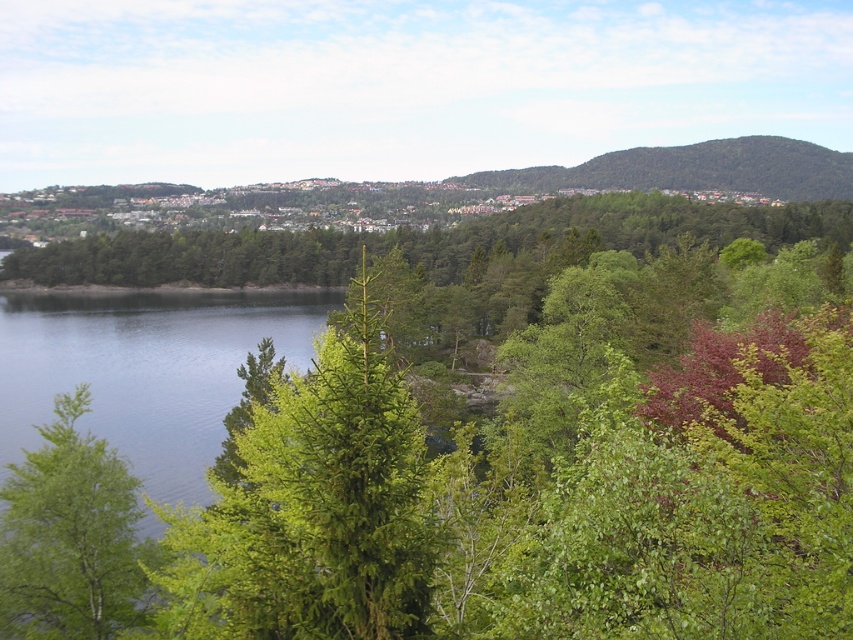
You are standing at the center of the image and want to reach the blue water at left. Which direction should you move in to get there?

The blue water at left is located at point (144,368), so you should move to the left to reach it.